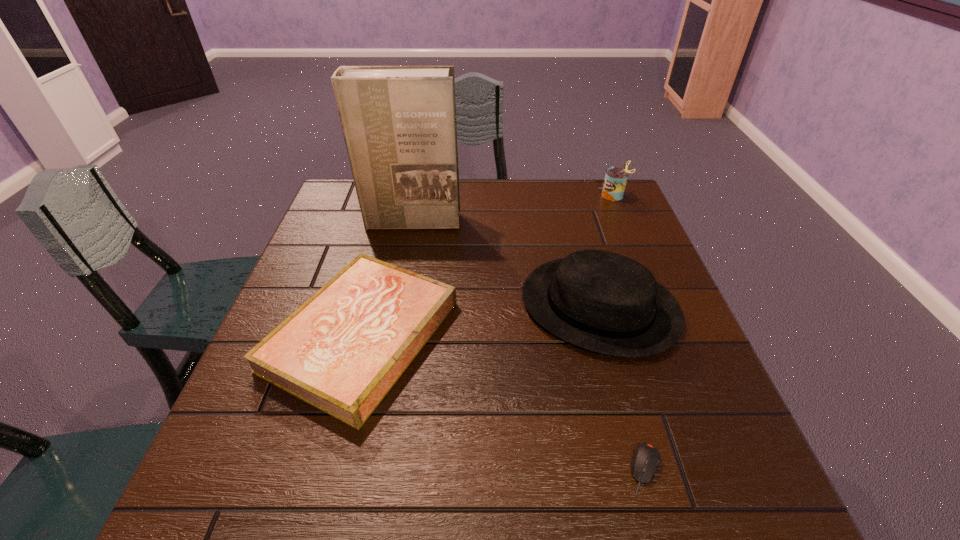
This screenshot has width=960, height=540. What are the coordinates of `free space that satisfies the following two spatial constraints: 1. on the back side of the fourth tallest object; 2. on the right side of the fedora` in the screenshot? It's located at (370, 307).